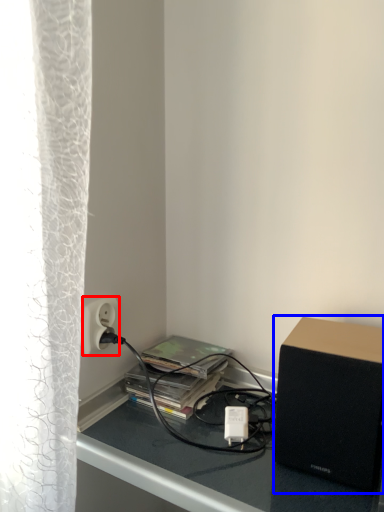
Question: Which object appears closest to the camera in this image, power outlet (highlighted by a red box) or loudspeaker (highlighted by a blue box)?

Choices:
 (A) power outlet
 (B) loudspeaker

Answer: (B)